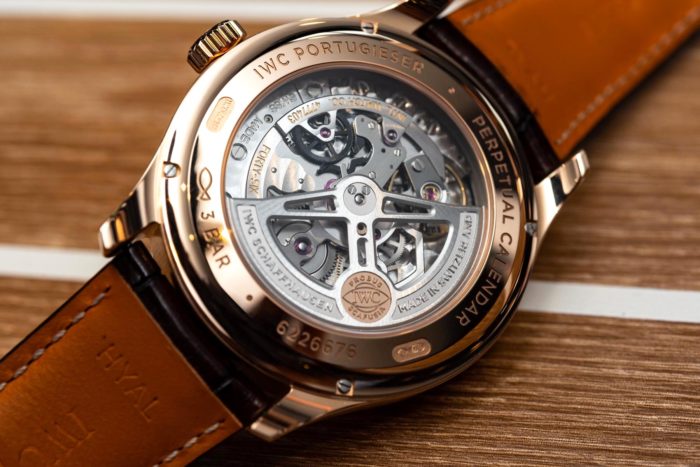
Locate an element on the screen. This screenshot has width=700, height=467. woodgrain surface under watch is located at coordinates (578, 370).